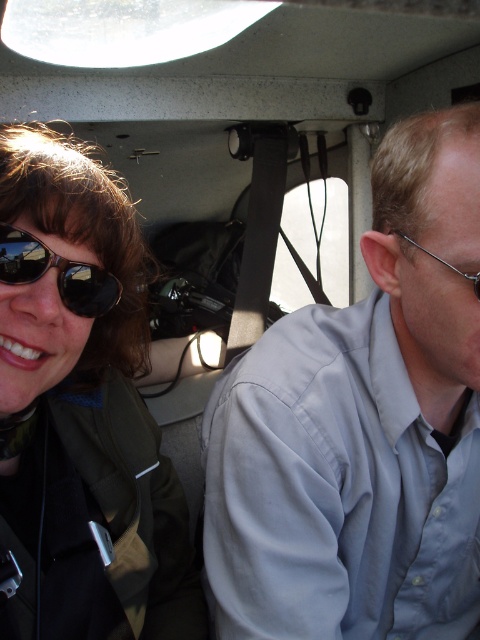
Question: Among these objects, which one is farthest from the camera?

Choices:
 (A) clear plastic glasses at right
 (B) light blue shirt at center
 (C) black reflective sunglasses at left
 (D) matte black sunglasses at upper left

Answer: (B)

Question: Which is farther from the matte black sunglasses at upper left?

Choices:
 (A) black reflective sunglasses at left
 (B) clear plastic glasses at right

Answer: (B)

Question: Does light blue shirt at center appear over clear plastic glasses at right?

Choices:
 (A) no
 (B) yes

Answer: (A)

Question: Estimate the real-world distances between objects in this image. Which object is closer to the matte black sunglasses at upper left?

Choices:
 (A) clear plastic glasses at right
 (B) black reflective sunglasses at left
 (C) light blue shirt at center

Answer: (B)

Question: Is light blue shirt at center closer to camera compared to clear plastic glasses at right?

Choices:
 (A) yes
 (B) no

Answer: (B)

Question: Is matte black sunglasses at upper left wider than black reflective sunglasses at left?

Choices:
 (A) no
 (B) yes

Answer: (B)